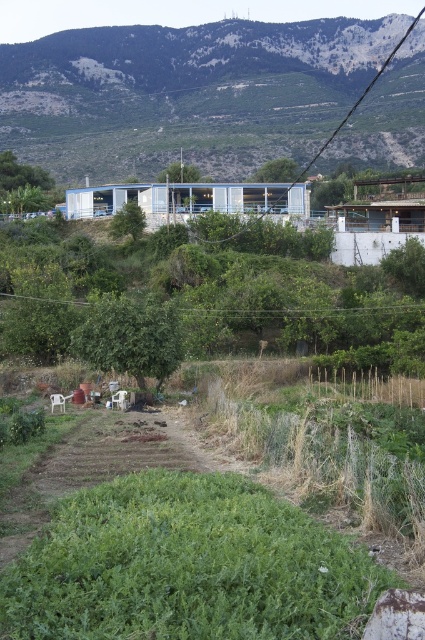
Question: Which of the following is the farthest from the observer?

Choices:
 (A) (251, 312)
 (B) (70, 74)
 (C) (331, 141)

Answer: (B)

Question: Which point is closer to the camera taking this photo?

Choices:
 (A) (178, 29)
 (B) (232, 237)
 (C) (374, 312)

Answer: (C)

Question: Observing the image, what is the correct spatial positioning of green wire at center in reference to black wire at upper center?

Choices:
 (A) right
 (B) left

Answer: (B)

Question: Which object is the farthest from the black wire at upper center?

Choices:
 (A) green wire at center
 (B) green grassy hillside at upper center

Answer: (A)

Question: Observing the image, what is the correct spatial positioning of green grassy hillside at upper center in reference to green wire at center?

Choices:
 (A) below
 (B) above

Answer: (B)

Question: Is green grassy hillside at upper center smaller than green wire at center?

Choices:
 (A) no
 (B) yes

Answer: (A)